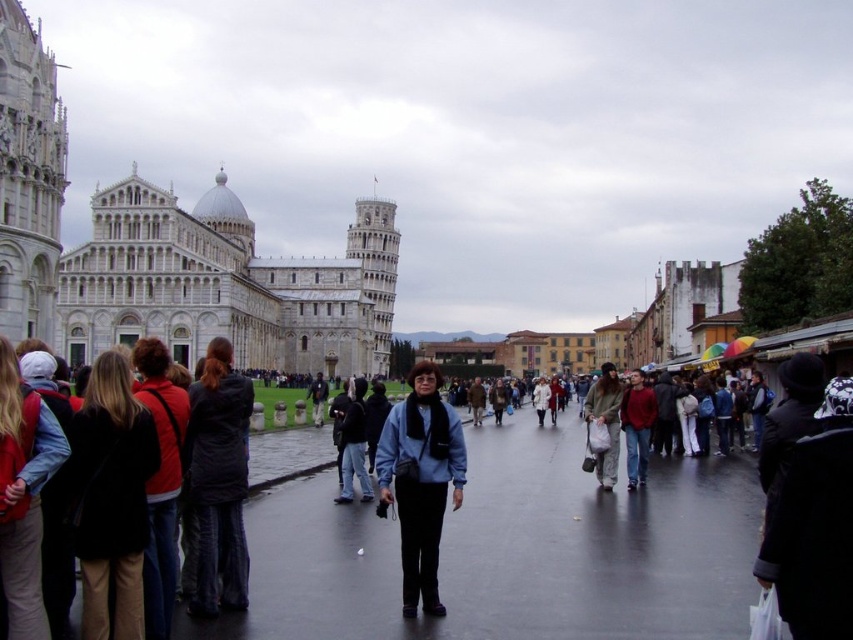
Question: Considering the relative positions of red fleece jacket at left and dark blue sweater at center in the image provided, where is red fleece jacket at left located with respect to dark blue sweater at center?

Choices:
 (A) above
 (B) below

Answer: (A)

Question: Which of the following is the farthest from the observer?

Choices:
 (A) black wool coat at left
 (B) white stone tower at center
 (C) matte gray jacket at center

Answer: (B)

Question: Among these objects, which one is nearest to the camera?

Choices:
 (A) dark blue sweater at center
 (B) denim jacket at center
 (C) dark blue fabric jacket at left

Answer: (C)

Question: Does denim jacket at center have a smaller size compared to matte gray jacket at center?

Choices:
 (A) no
 (B) yes

Answer: (B)

Question: Is the position of dark blue fabric jacket at left less distant than that of matte gray jacket at center?

Choices:
 (A) no
 (B) yes

Answer: (B)

Question: Which point is farther to the camera?

Choices:
 (A) (178, 291)
 (B) (363, 492)

Answer: (A)